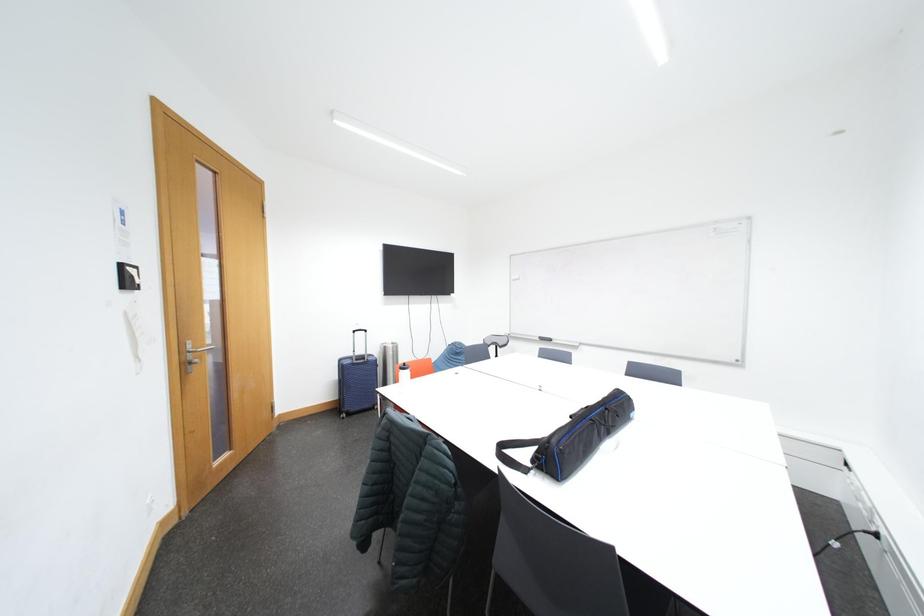
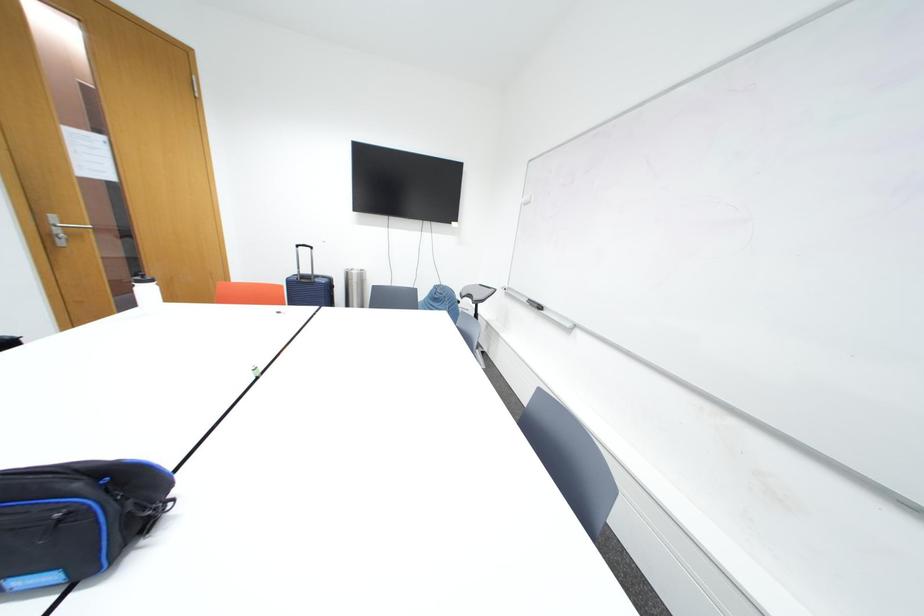
In a continuous first-person perspective shot, in which direction is the camera moving?

The cameraman moved toward right, forward.